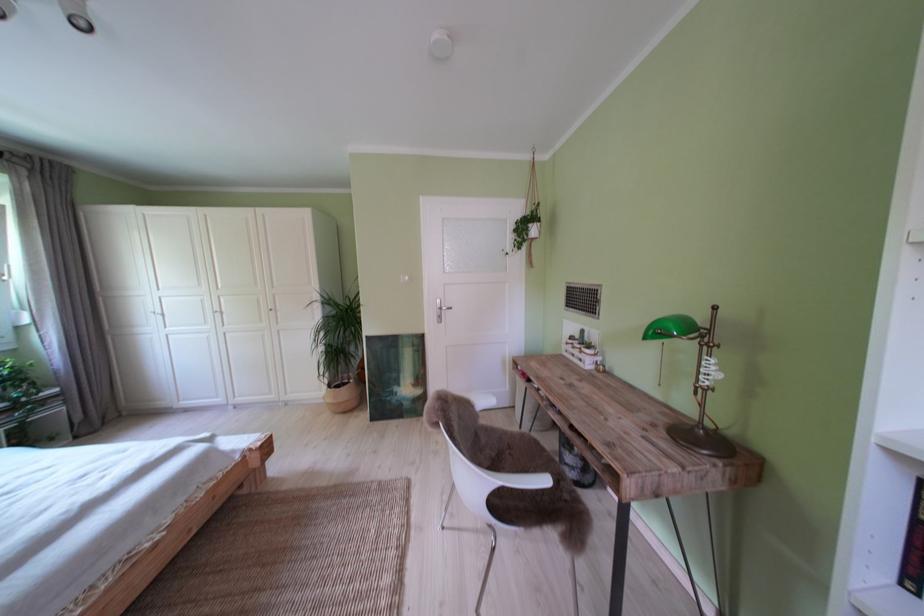
What do you see at coordinates (520, 479) in the screenshot? The width and height of the screenshot is (924, 616). I see `a chair armrest` at bounding box center [520, 479].